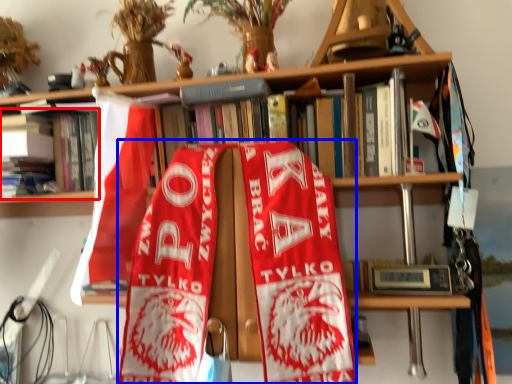
Question: Among these objects, which one is farthest to the camera, book (highlighted by a red box) or beach towel (highlighted by a blue box)?

Choices:
 (A) book
 (B) beach towel

Answer: (A)